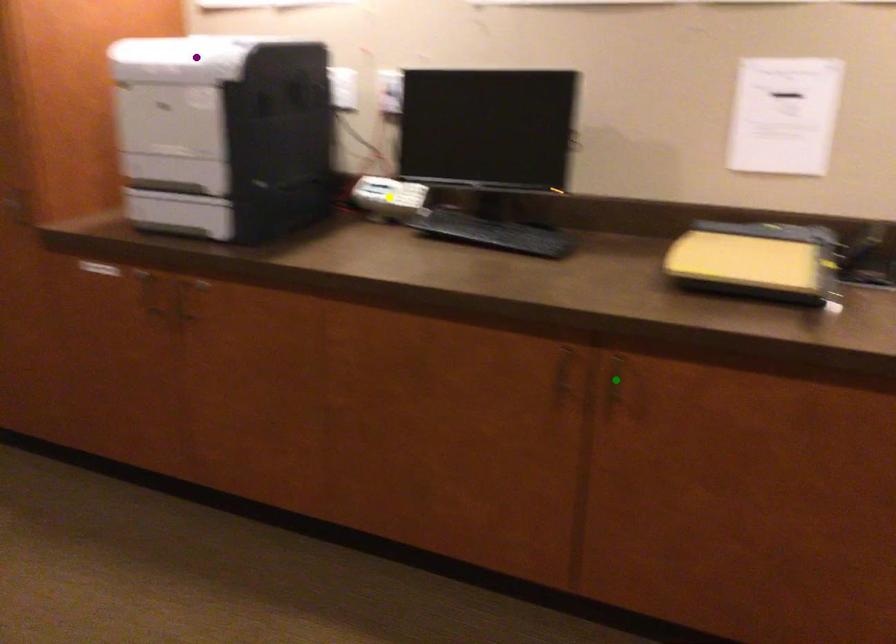
Order these from nearest to farthest:
yellow point
purple point
green point

green point, purple point, yellow point